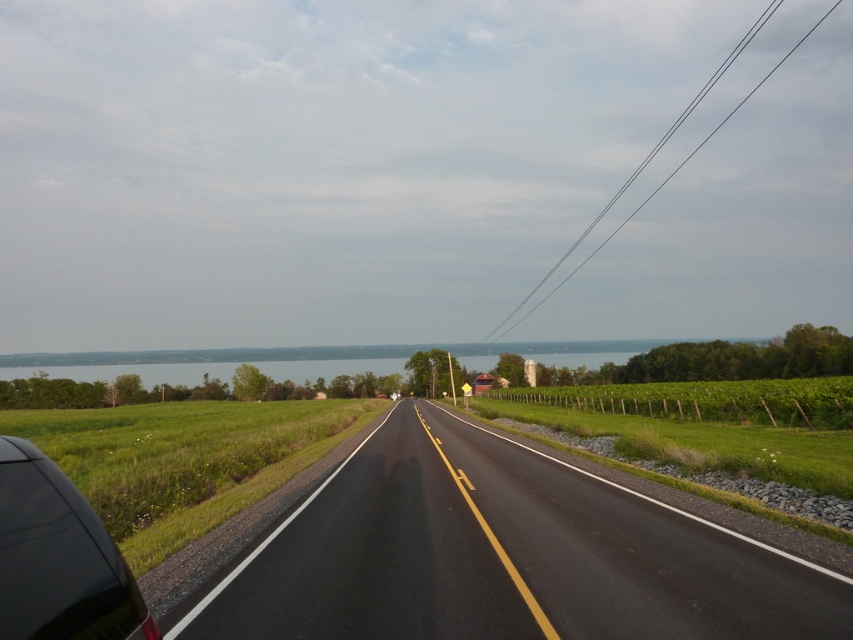
You are a driver approaching the shiny black car at lower left on the black asphalt highway at center. According to the road markings, can you safely pass the car on either side?

The black asphalt highway at center has a double yellow line, which typically indicates no passing zones. Therefore, you cannot safely pass the shiny black car at lower left on either side.

You are standing at the point marked as point (503, 556) on the black asphalt highway at center. If you look towards the direction of the road, what will you see in the distance?

You will see a body of water, likely a lake or river, stretching across the horizon beyond which there are faint hills or low mountains.